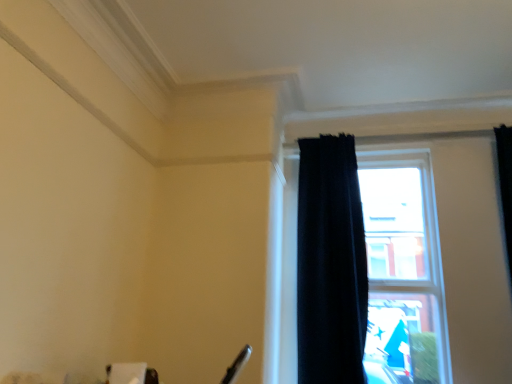
Question: From a real-world perspective, is black curtain at right on top of black velvet curtain at right?

Choices:
 (A) no
 (B) yes

Answer: (A)

Question: Can you confirm if black curtain at right is wider than black velvet curtain at right?

Choices:
 (A) yes
 (B) no

Answer: (B)

Question: Does black curtain at right lie behind black velvet curtain at right?

Choices:
 (A) no
 (B) yes

Answer: (B)

Question: Could you tell me if black curtain at right is turned towards black velvet curtain at right?

Choices:
 (A) no
 (B) yes

Answer: (B)

Question: Considering the relative sizes of black curtain at right and black velvet curtain at right in the image provided, is black curtain at right smaller than black velvet curtain at right?

Choices:
 (A) yes
 (B) no

Answer: (B)

Question: Can you confirm if black curtain at right is taller than black velvet curtain at right?

Choices:
 (A) no
 (B) yes

Answer: (A)

Question: Is black velvet curtain at right taller than black curtain at right?

Choices:
 (A) yes
 (B) no

Answer: (A)

Question: From a real-world perspective, is black velvet curtain at right over black curtain at right?

Choices:
 (A) yes
 (B) no

Answer: (A)

Question: Is black velvet curtain at right to the right of black curtain at right from the viewer's perspective?

Choices:
 (A) yes
 (B) no

Answer: (B)

Question: Considering the relative sizes of black velvet curtain at right and black curtain at right in the image provided, is black velvet curtain at right smaller than black curtain at right?

Choices:
 (A) no
 (B) yes

Answer: (B)

Question: From the image's perspective, is black velvet curtain at right on black curtain at right?

Choices:
 (A) yes
 (B) no

Answer: (A)

Question: Is black velvet curtain at right positioned with its back to black curtain at right?

Choices:
 (A) yes
 (B) no

Answer: (A)

Question: Is black curtain at right situated inside black velvet curtain at right or outside?

Choices:
 (A) outside
 (B) inside

Answer: (A)